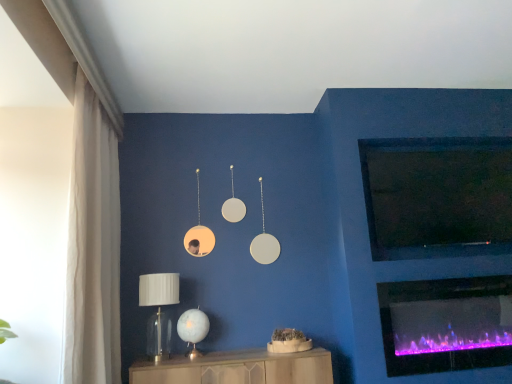
Question: Does purple electric fireplace at lower right have a smaller size compared to clear glass table lamp at lower left, which is counted as the 2th table lamp, starting from the right?

Choices:
 (A) yes
 (B) no

Answer: (B)

Question: Could clear glass table lamp at lower left, which is the first table lamp from left to right, be considered to be inside purple electric fireplace at lower right?

Choices:
 (A) no
 (B) yes

Answer: (A)

Question: Is purple electric fireplace at lower right aimed at clear glass table lamp at lower left, which is the first table lamp from left to right?

Choices:
 (A) yes
 (B) no

Answer: (B)

Question: Is purple electric fireplace at lower right at the left side of clear glass table lamp at lower left, which is the first table lamp from left to right?

Choices:
 (A) no
 (B) yes

Answer: (A)

Question: Is the surface of purple electric fireplace at lower right in direct contact with clear glass table lamp at lower left, which is the first table lamp from left to right?

Choices:
 (A) no
 (B) yes

Answer: (A)

Question: In the image, is wooden cabinet at lower center positioned in front of or behind white sheer curtain at left?

Choices:
 (A) front
 (B) behind

Answer: (B)

Question: Is wooden cabinet at lower center inside or outside of white sheer curtain at left?

Choices:
 (A) outside
 (B) inside

Answer: (A)

Question: From their relative heights in the image, would you say wooden cabinet at lower center is taller or shorter than white sheer curtain at left?

Choices:
 (A) short
 (B) tall

Answer: (A)

Question: From the image's perspective, relative to white sheer curtain at left, is wooden cabinet at lower center above or below?

Choices:
 (A) below
 (B) above

Answer: (A)

Question: Is clear glass table lamp at lower left, which is the first table lamp from left to right, taller or shorter than wooden cabinet at lower center?

Choices:
 (A) short
 (B) tall

Answer: (B)

Question: In the image, is clear glass table lamp at lower left, which is the first table lamp from left to right, positioned in front of or behind wooden cabinet at lower center?

Choices:
 (A) front
 (B) behind

Answer: (B)

Question: Considering the positions of clear glass table lamp at lower left, which is counted as the 2th table lamp, starting from the right, and wooden cabinet at lower center in the image, is clear glass table lamp at lower left, which is counted as the 2th table lamp, starting from the right, wider or thinner than wooden cabinet at lower center?

Choices:
 (A) wide
 (B) thin

Answer: (B)

Question: Considering the positions of clear glass table lamp at lower left, which is counted as the 2th table lamp, starting from the right, and wooden cabinet at lower center in the image, is clear glass table lamp at lower left, which is counted as the 2th table lamp, starting from the right, bigger or smaller than wooden cabinet at lower center?

Choices:
 (A) small
 (B) big

Answer: (A)

Question: Looking at their shapes, would you say wooden cabinet at lower center is wider or thinner than black matte tv at upper right?

Choices:
 (A) wide
 (B) thin

Answer: (A)

Question: Is point (132, 380) positioned closer to the camera than point (384, 258)?

Choices:
 (A) farther
 (B) closer

Answer: (B)